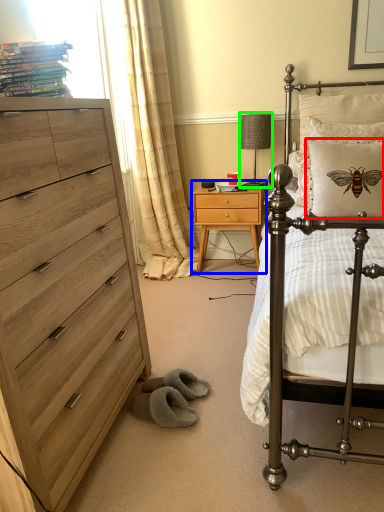
Question: Based on their relative distances, which object is farther from pillow (highlighted by a red box)? Choose from nightstand (highlighted by a blue box) and table lamp (highlighted by a green box).

Choices:
 (A) nightstand
 (B) table lamp

Answer: (B)